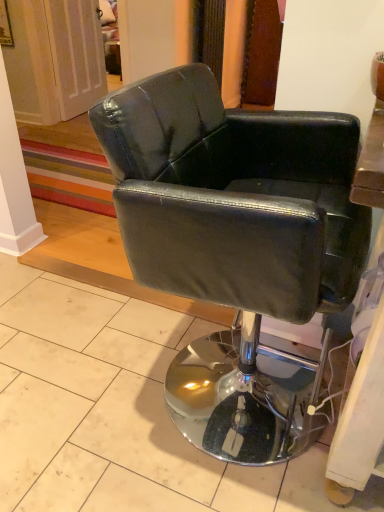
Locate an element on the screen. vacant space situated on the left part of black leather chair at center is located at coordinates (81, 377).